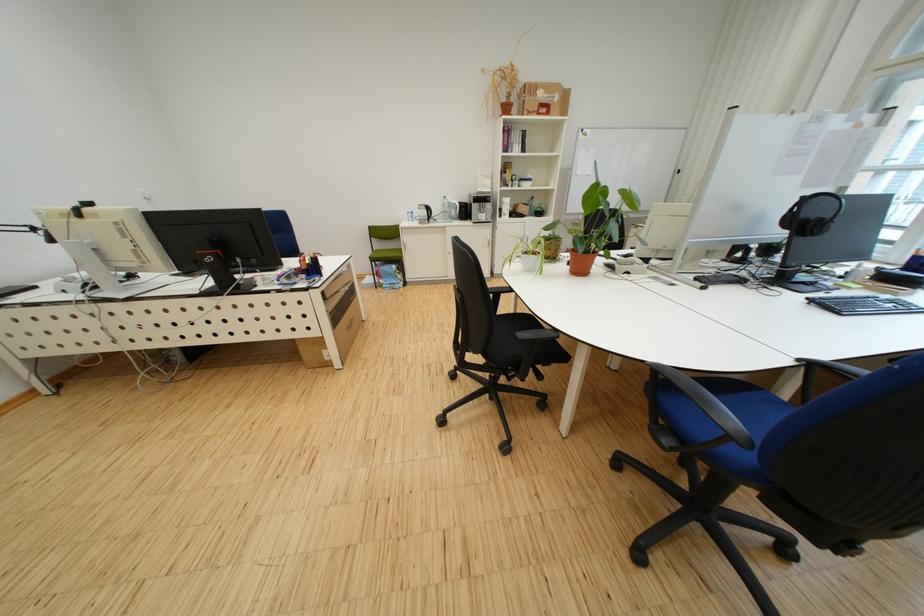
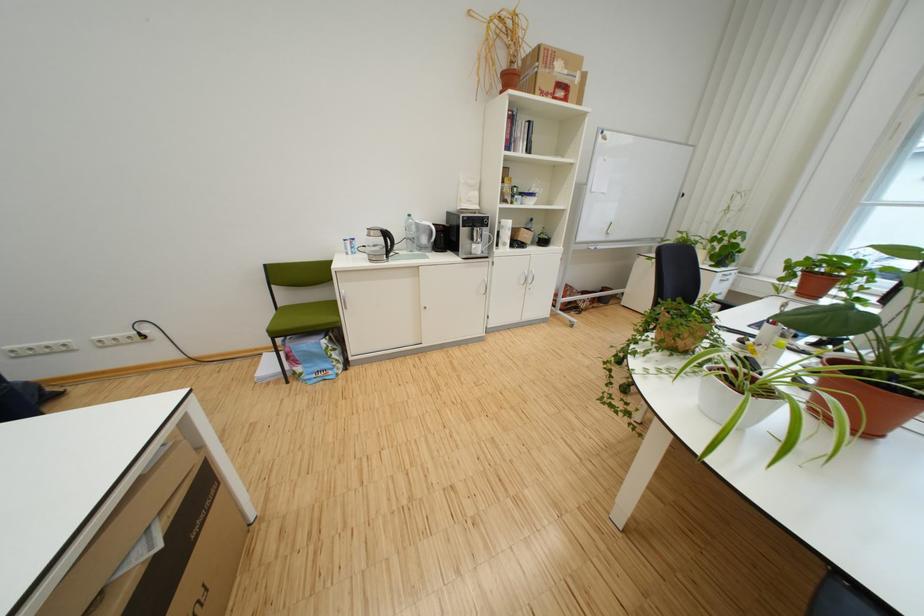
Where in the second image is the point corresponding to pixel 541 115 from the first image?

(553, 95)